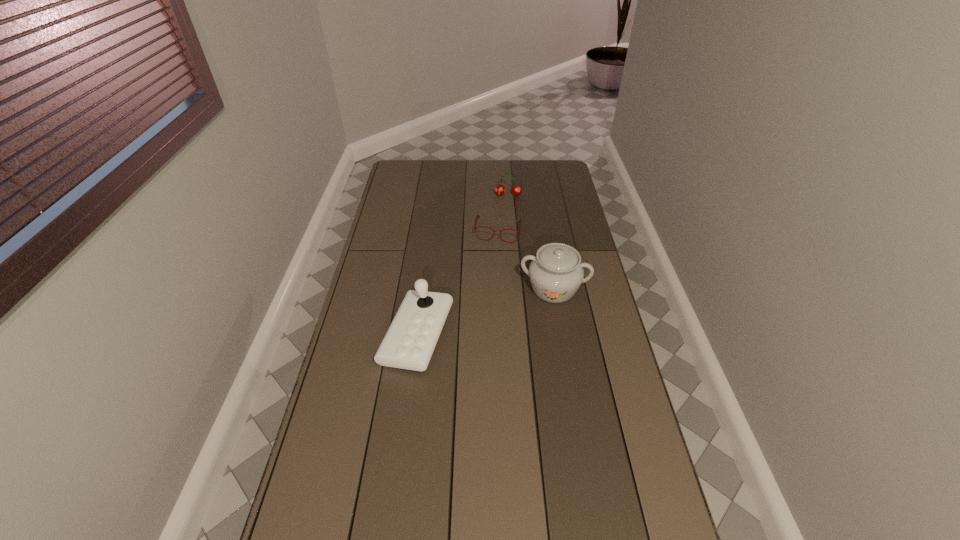
I want to click on free space on the desktop that is between the leftmost object and the chinaware and is positioned with stems pointing upwards on the cherry, so click(505, 305).

Identify the location of vacant space on the desktop that is between the joystick and the chinaware and is positioned on the face of the third nearest object. (484, 312).